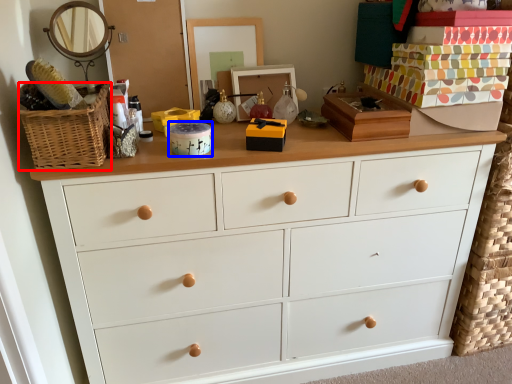
Question: Which point is further to the camera, basket (highlighted by a red box) or box (highlighted by a blue box)?

Choices:
 (A) basket
 (B) box

Answer: (B)